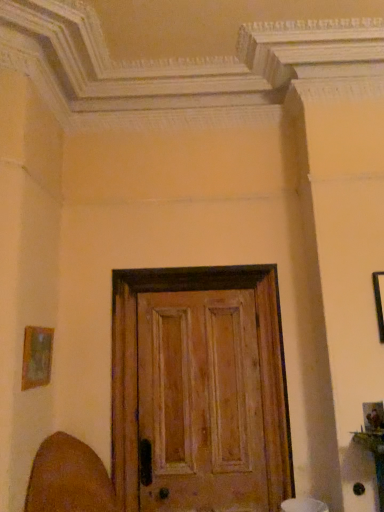
Question: Can you confirm if brown leather swivel chair at lower left is positioned to the left of black matte picture frame at upper right, the first picture frame from the right?

Choices:
 (A) no
 (B) yes

Answer: (B)

Question: Is brown leather swivel chair at lower left positioned in front of black matte picture frame at upper right, the 2th picture frame positioned from the left?

Choices:
 (A) no
 (B) yes

Answer: (B)

Question: Is brown leather swivel chair at lower left positioned with its back to black matte picture frame at upper right, the 2th picture frame positioned from the left?

Choices:
 (A) no
 (B) yes

Answer: (A)

Question: Considering the relative sizes of brown leather swivel chair at lower left and black matte picture frame at upper right, the first picture frame from the right, in the image provided, is brown leather swivel chair at lower left taller than black matte picture frame at upper right, the first picture frame from the right,?

Choices:
 (A) no
 (B) yes

Answer: (B)

Question: Is brown leather swivel chair at lower left outside of black matte picture frame at upper right, the 2th picture frame positioned from the left?

Choices:
 (A) yes
 (B) no

Answer: (A)

Question: Is wooden frame at left, the first picture frame positioned from the left, in front of or behind brown leather swivel chair at lower left in the image?

Choices:
 (A) behind
 (B) front

Answer: (A)

Question: From the image's perspective, relative to brown leather swivel chair at lower left, is wooden frame at left, acting as the second picture frame starting from the right, above or below?

Choices:
 (A) above
 (B) below

Answer: (A)

Question: Is point (21, 387) positioned closer to the camera than point (61, 503)?

Choices:
 (A) farther
 (B) closer

Answer: (B)

Question: From a real-world perspective, relative to brown leather swivel chair at lower left, is wooden frame at left, acting as the second picture frame starting from the right, vertically above or below?

Choices:
 (A) above
 (B) below

Answer: (A)

Question: Is point (382, 278) positioned closer to the camera than point (39, 329)?

Choices:
 (A) farther
 (B) closer

Answer: (A)

Question: In the image, is black matte picture frame at upper right, the 2th picture frame positioned from the left, on the left side or the right side of wooden frame at left, the first picture frame positioned from the left?

Choices:
 (A) left
 (B) right

Answer: (B)

Question: In terms of height, does black matte picture frame at upper right, the 2th picture frame positioned from the left, look taller or shorter compared to wooden frame at left, acting as the second picture frame starting from the right?

Choices:
 (A) tall
 (B) short

Answer: (A)

Question: Would you say black matte picture frame at upper right, the 2th picture frame positioned from the left, is inside or outside wooden frame at left, acting as the second picture frame starting from the right?

Choices:
 (A) outside
 (B) inside

Answer: (A)

Question: From a real-world perspective, is brown leather swivel chair at lower left physically located above or below wooden frame at left, acting as the second picture frame starting from the right?

Choices:
 (A) below
 (B) above

Answer: (A)

Question: Relative to wooden frame at left, acting as the second picture frame starting from the right, is brown leather swivel chair at lower left in front or behind?

Choices:
 (A) front
 (B) behind

Answer: (A)